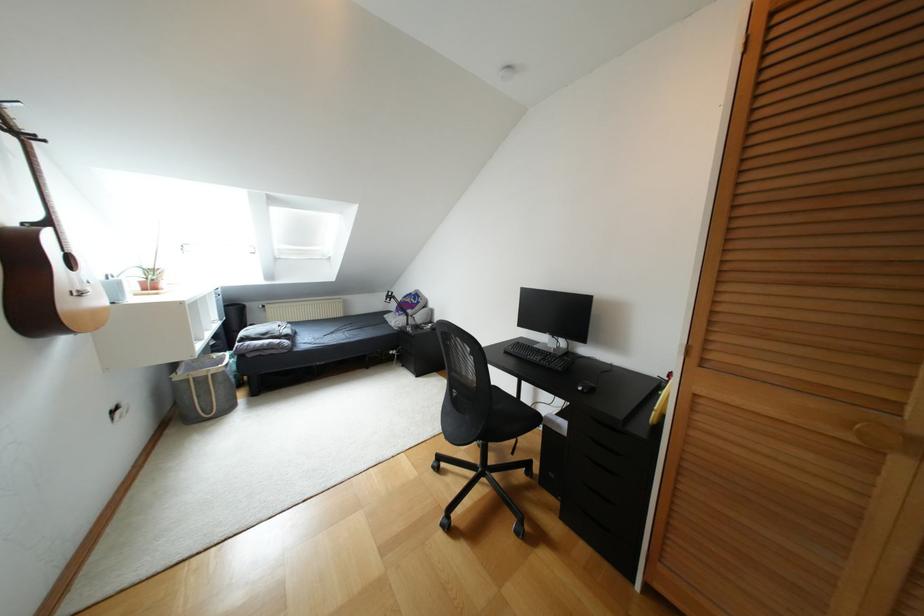
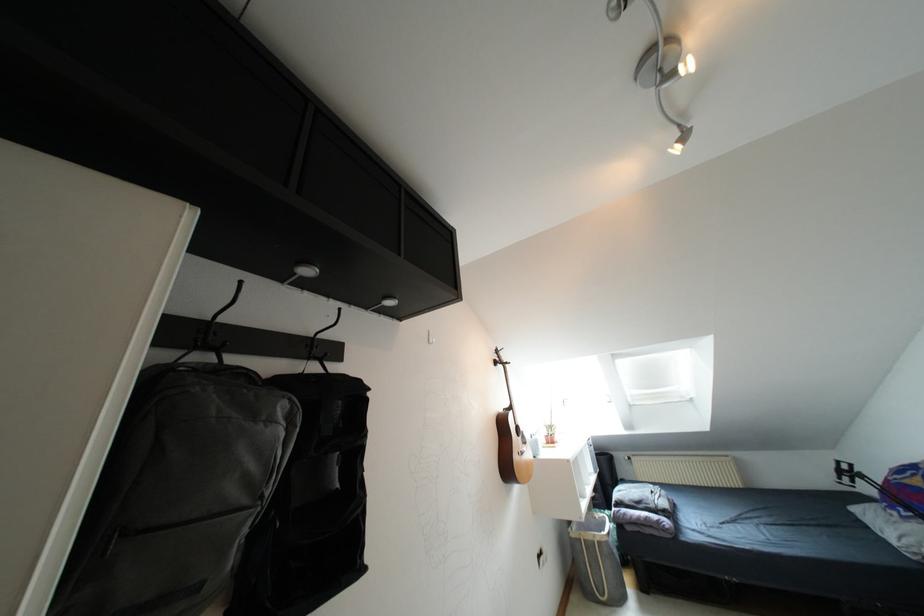
Find the pixel in the second image that matches point (227, 408) in the first image.

(618, 599)